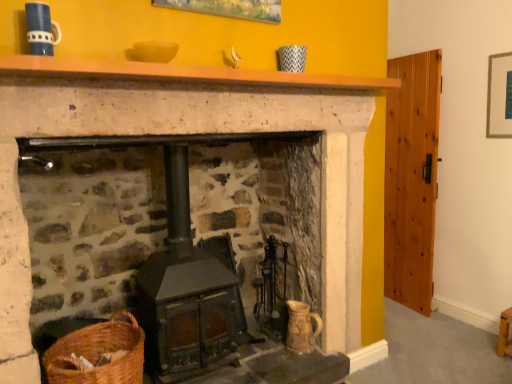
At what (x,y) coordinates should I click in order to perform the action: click on woven brown basket at lower left. Please return your answer as a coordinate pair (x, y). This screenshot has width=512, height=384. Looking at the image, I should click on (98, 353).

The image size is (512, 384). Describe the element at coordinates (499, 96) in the screenshot. I see `metallic silver picture frame at upper right` at that location.

Image resolution: width=512 pixels, height=384 pixels. Find the location of `metallic silver picture frame at upper right`. metallic silver picture frame at upper right is located at coordinates (499, 96).

Image resolution: width=512 pixels, height=384 pixels. I want to click on wooden mantle at upper center, so click(x=185, y=73).

Where is `woven brown basket at lower left`? woven brown basket at lower left is located at coordinates (98, 353).

Does wooden stool at lower right contain rustic wood stove at center?

No, wooden stool at lower right does not contain rustic wood stove at center.

From the image's perspective, is wooden stool at lower right on rustic wood stove at center?

No, from the image's perspective, wooden stool at lower right is not on top of rustic wood stove at center.

From their relative heights in the image, would you say wooden stool at lower right is taller or shorter than rustic wood stove at center?

Considering their sizes, wooden stool at lower right has less height than rustic wood stove at center.

Based on the photo, is metallic silver picture frame at upper right bigger than rustic wood stove at center?

Actually, metallic silver picture frame at upper right might be smaller than rustic wood stove at center.

In the image, is metallic silver picture frame at upper right positioned in front of or behind rustic wood stove at center?

In the image, metallic silver picture frame at upper right appears behind rustic wood stove at center.

Is metallic silver picture frame at upper right facing away from rustic wood stove at center?

metallic silver picture frame at upper right is not turned away from rustic wood stove at center.

Which is more to the left, metallic silver picture frame at upper right or rustic wood stove at center?

Positioned to the left is rustic wood stove at center.

Would you say wooden mantle at upper center contains wooden stool at lower right?

Actually, wooden stool at lower right is outside wooden mantle at upper center.

Which object is positioned more to the right, wooden mantle at upper center or wooden stool at lower right?

From the viewer's perspective, wooden stool at lower right appears more on the right side.

Measure the distance from wooden mantle at upper center to wooden stool at lower right.

wooden mantle at upper center is 6.87 feet away from wooden stool at lower right.

From the image's perspective, which one is positioned lower, wooden mantle at upper center or wooden stool at lower right?

wooden stool at lower right is shown below in the image.

From a real-world perspective, which object rests below the other?

In real-world perspective, wooden stool at lower right is lower.

Is metallic silver picture frame at upper right placed right next to wooden stool at lower right?

No, metallic silver picture frame at upper right is not in contact with wooden stool at lower right.

What's the angular difference between metallic silver picture frame at upper right and wooden stool at lower right's facing directions?

There is a 2.91-degree angle between the facing directions of metallic silver picture frame at upper right and wooden stool at lower right.

Considering the relative positions of metallic silver picture frame at upper right and wooden stool at lower right in the image provided, is metallic silver picture frame at upper right to the left of wooden stool at lower right from the viewer's perspective?

Indeed, metallic silver picture frame at upper right is positioned on the left side of wooden stool at lower right.

Is point (313, 79) less distant than point (195, 268)?

That is True.

Is wooden mantle at upper center next to rustic wood stove at center?

wooden mantle at upper center and rustic wood stove at center are clearly separated.

Between wooden mantle at upper center and rustic wood stove at center, which one has larger width?

rustic wood stove at center is wider.

Considering their positions, is wooden mantle at upper center located in front of or behind rustic wood stove at center?

In the image, wooden mantle at upper center appears in front of rustic wood stove at center.

Is metallic silver picture frame at upper right far from wooden mantle at upper center?

Yes, metallic silver picture frame at upper right and wooden mantle at upper center are quite far apart.

Locate an element on the screen. This screenshot has width=512, height=384. picture frame that appears behind the wooden mantle at upper center is located at coordinates (499, 96).

Is metallic silver picture frame at upper right thinner than wooden mantle at upper center?

Correct, the width of metallic silver picture frame at upper right is less than that of wooden mantle at upper center.

How many degrees apart are the facing directions of metallic silver picture frame at upper right and wooden mantle at upper center?

90.7 degrees.

From the image's perspective, is rustic wood stove at center positioned above or below metallic silver picture frame at upper right?

From the image's perspective, rustic wood stove at center appears below metallic silver picture frame at upper right.

In terms of width, does rustic wood stove at center look wider or thinner when compared to metallic silver picture frame at upper right?

rustic wood stove at center is wider than metallic silver picture frame at upper right.

From a real-world perspective, which is physically below, rustic wood stove at center or metallic silver picture frame at upper right?

In real-world perspective, rustic wood stove at center is lower.

Based on their positions, is rustic wood stove at center located to the left or right of metallic silver picture frame at upper right?

From the image, it's evident that rustic wood stove at center is to the left of metallic silver picture frame at upper right.

At what (x,y) coordinates should I click in order to perform the action: click on stove above the wooden stool at lower right (from a real-world perspective). Please return your answer as a coordinate pair (x, y). The width and height of the screenshot is (512, 384). Looking at the image, I should click on (186, 293).

Locate an element on the screen. picture frame behind the rustic wood stove at center is located at coordinates (499, 96).

Estimate the real-world distances between objects in this image. Which object is further from wooden stool at lower right, metallic silver picture frame at upper right or wooden mantle at upper center?

wooden mantle at upper center.

When comparing their distances from wooden stool at lower right, does rustic wood stove at center or wooden mantle at upper center seem further?

Among the two, wooden mantle at upper center is located further to wooden stool at lower right.

Considering their positions, is rustic wood stove at center positioned further to woven brown basket at lower left than wooden stool at lower right?

wooden stool at lower right is positioned further to the anchor woven brown basket at lower left.

Looking at the image, which one is located closer to wooden stool at lower right, metallic silver picture frame at upper right or rustic wood stove at center?

metallic silver picture frame at upper right.

When comparing their distances from wooden stool at lower right, does woven brown basket at lower left or metallic silver picture frame at upper right seem closer?

metallic silver picture frame at upper right lies closer to wooden stool at lower right than the other object.

When comparing their distances from metallic silver picture frame at upper right, does wooden stool at lower right or woven brown basket at lower left seem closer?

wooden stool at lower right is positioned closer to the anchor metallic silver picture frame at upper right.

From the image, which object appears to be farther from rustic wood stove at center, wooden stool at lower right or woven brown basket at lower left?

wooden stool at lower right is further to rustic wood stove at center.

In the scene shown: Considering their positions, is wooden stool at lower right positioned further to wooden mantle at upper center than woven brown basket at lower left?

Among the two, wooden stool at lower right is located further to wooden mantle at upper center.

Find the location of a particular element. picture frame between woven brown basket at lower left and wooden stool at lower right is located at coordinates (499, 96).

You are a GUI agent. You are given a task and a screenshot of the screen. Output one action in this format:
    pyautogui.click(x=<x>, y=<y>)
    Task: Click on the mantle between woven brown basket at lower left and metallic silver picture frame at upper right from left to right
    
    Given the screenshot: What is the action you would take?
    pyautogui.click(x=185, y=73)

This screenshot has height=384, width=512. In order to click on mantle between rustic wood stove at center and wooden stool at lower right from left to right in this screenshot , I will do `click(185, 73)`.

Find the location of `stove between woven brown basket at lower left and wooden stool at lower right in the horizontal direction`. stove between woven brown basket at lower left and wooden stool at lower right in the horizontal direction is located at coordinates (186, 293).